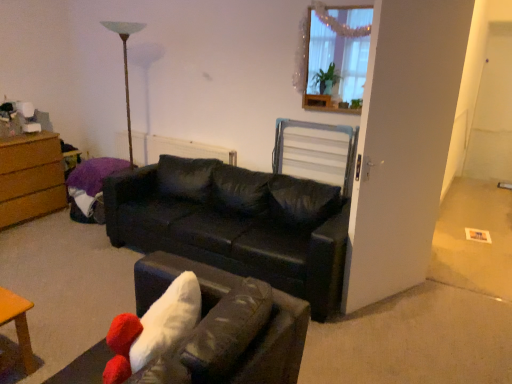
Question: Is black leather couch at center, the 2th studio couch in the front-to-back sequence, wider or thinner than metallic silver swivel chair at center?

Choices:
 (A) wide
 (B) thin

Answer: (A)

Question: Is point (314, 279) closer or farther from the camera than point (320, 170)?

Choices:
 (A) farther
 (B) closer

Answer: (B)

Question: Which object is positioned closest to the wooden frame at upper right?

Choices:
 (A) brown wood chest of drawers at left
 (B) white textured radiator at center
 (C) metallic silver swivel chair at center
 (D) black leather couch at center, the first studio couch from the front
 (E) black leather couch at center, the 2th studio couch in the front-to-back sequence

Answer: (C)

Question: Which object is the farthest from the black leather couch at center, the first studio couch from the front?

Choices:
 (A) wooden frame at upper right
 (B) white textured radiator at center
 (C) black leather couch at center, the 2th studio couch in the front-to-back sequence
 (D) metallic silver swivel chair at center
 (E) brown wood chest of drawers at left

Answer: (E)